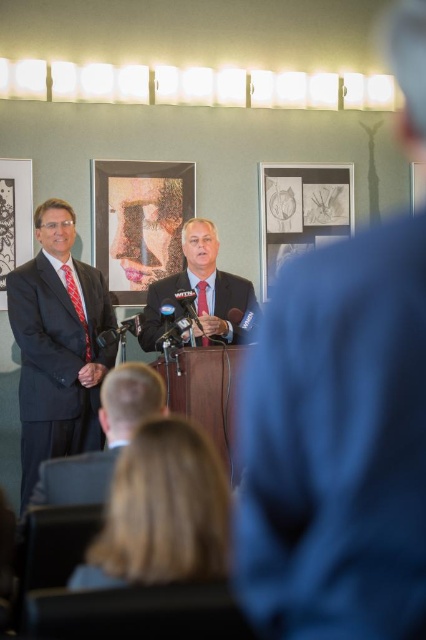
Question: Which point is closer to the camera?

Choices:
 (A) (209, 260)
 (B) (138, 241)

Answer: (A)

Question: Does dark suit at center appear on the right side of matte black picture frame at left?

Choices:
 (A) no
 (B) yes

Answer: (B)

Question: Is matte black suit at left further to the viewer compared to red silk tie at left?

Choices:
 (A) yes
 (B) no

Answer: (B)

Question: Estimate the real-world distances between objects in this image. Which object is farther from the dark suit at center?

Choices:
 (A) matte black suit at center
 (B) matte black picture frame at left

Answer: (B)

Question: Does red silk tie at left appear under red silk tie at center?

Choices:
 (A) no
 (B) yes

Answer: (A)

Question: Which point is farther from the camera taking this photo?

Choices:
 (A) (118, 236)
 (B) (328, 193)
 (C) (141, 381)

Answer: (B)